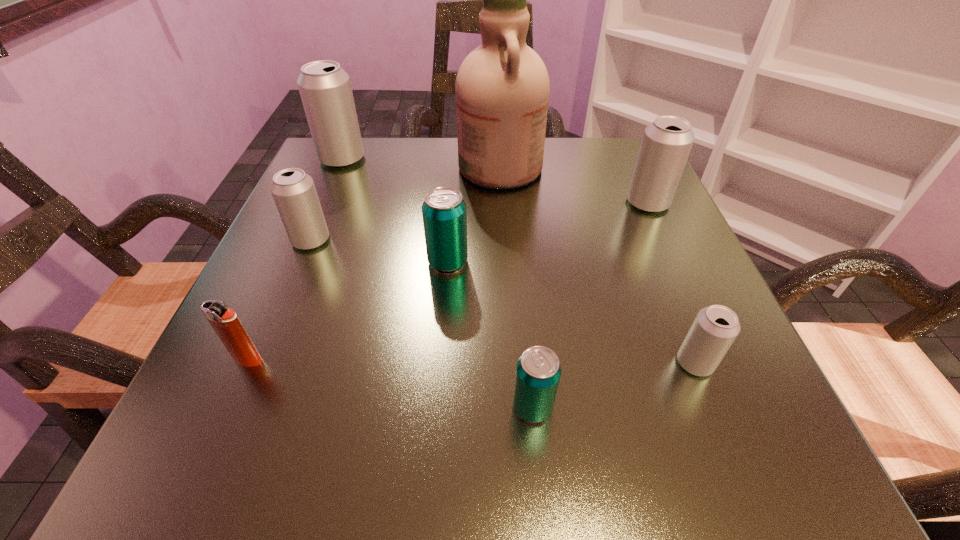
You are a GUI agent. You are given a task and a screenshot of the screen. Output one action in this format:
    pyautogui.click(x=<x>, y=<y>)
    Task: Click on the smallest white beer can
    The height and width of the screenshot is (540, 960).
    Given the screenshot: What is the action you would take?
    pyautogui.click(x=715, y=328)

You are a GUI agent. You are given a task and a screenshot of the screen. Output one action in this format:
    pyautogui.click(x=<x>, y=<y>)
    Task: Click on the right teal beer can
    The image size is (960, 540).
    Given the screenshot: What is the action you would take?
    pyautogui.click(x=538, y=371)

Where is `the smaller teal beer can`? This screenshot has width=960, height=540. the smaller teal beer can is located at coordinates (538, 371).

Find the location of a particular element. The width and height of the screenshot is (960, 540). vacant point located on the front label of the cleansing agent is located at coordinates (417, 167).

At what (x,y) coordinates should I click in order to perform the action: click on free location located 0.310m on the front label of the cleansing agent. Please return your answer as a coordinate pair (x, y). Image resolution: width=960 pixels, height=540 pixels. Looking at the image, I should click on (316, 167).

Locate an element on the screen. The width and height of the screenshot is (960, 540). vacant area situated 0.130m on the front label of the cleansing agent is located at coordinates (398, 167).

The width and height of the screenshot is (960, 540). I want to click on vacant point located 0.060m on the front of the farthest beer can, so click(x=330, y=186).

Find the location of `vacant space situated 0.110m on the left of the second biggest white beer can`. vacant space situated 0.110m on the left of the second biggest white beer can is located at coordinates (571, 202).

Where is `vacant area situated 0.250m on the front of the third biggest white beer can`? Image resolution: width=960 pixels, height=540 pixels. vacant area situated 0.250m on the front of the third biggest white beer can is located at coordinates (253, 377).

Locate an element on the screen. The height and width of the screenshot is (540, 960). vacant space situated 0.140m on the left of the farther teal beer can is located at coordinates (346, 262).